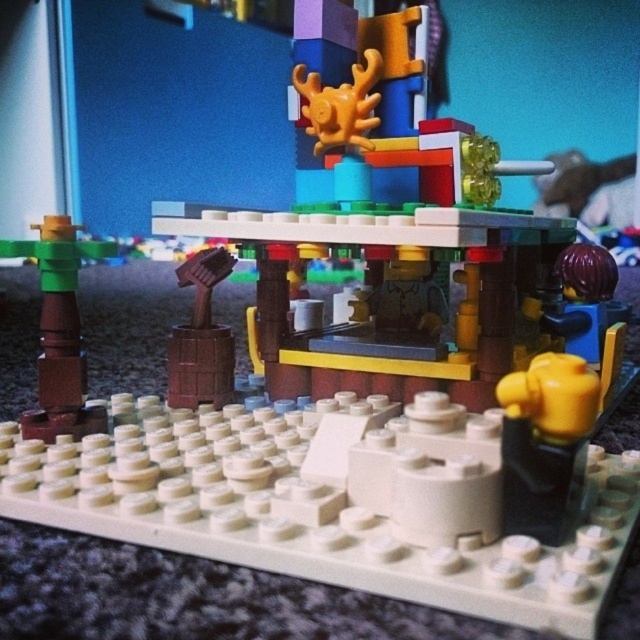
You are a delivery robot with a package that needs to be placed between the brown matte post at left and the wooden barrel at center. The package requires a minimum of 6 inches of space to fit. Can you place the package there?

The brown matte post at left is 6.57 inches from the wooden barrel at center, which is more than the required 6 inches. Therefore, the package can be placed between them with sufficient space.

You are standing at the camera position looking at the LEGO structure. There is a point marked at coordinates point (45, 340). If you want to touch this point with a measuring tool that can extend up to 30 inches, will it reach?

The distance between point (45, 340) and the camera is 31.21 inches. Since the measuring tool can only extend up to 30 inches, it will not reach the point.

You are looking at the LEGO structure and notice two points marked on it. The first point is at coordinates point (70, 266) and the second is at point (221, 344). Which of these points is nearer to you?

Point (70, 266) is closer to the viewer than point (221, 344).